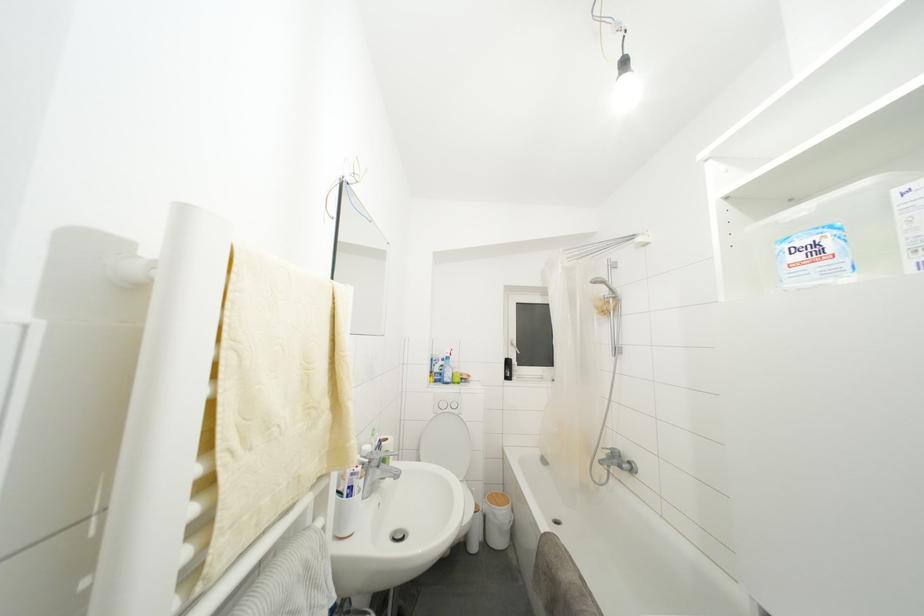
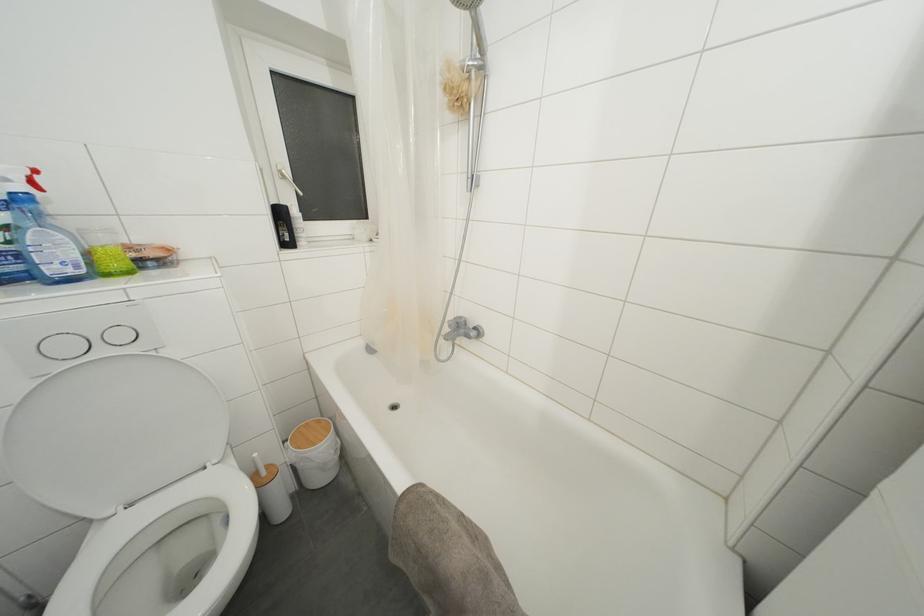
The point at (x=454, y=415) is marked in the first image. Where is the corresponding point in the second image?

(106, 357)